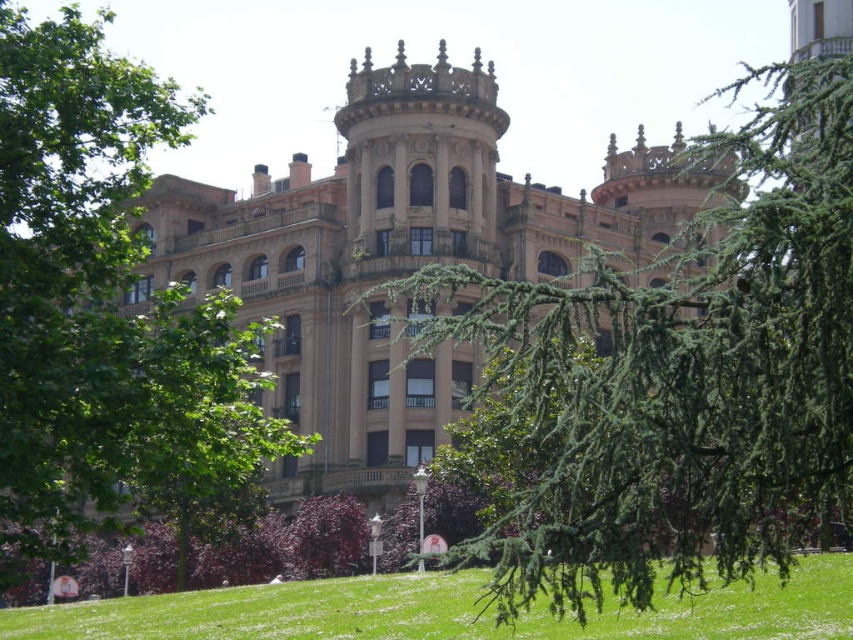
Looking at this image, who is positioned more to the left, green leafy tree at left or purple leafy tree at center?

Positioned to the left is green leafy tree at left.

Which is in front, point (183, 468) or point (317, 560)?

Positioned in front is point (183, 468).

Who is more distant from viewer, [86,92] or [303,541]?

The point [303,541] is behind.

You are a GUI agent. You are given a task and a screenshot of the screen. Output one action in this format:
    pyautogui.click(x=<x>, y=<y>)
    Task: Click on the green leafy tree at left
    This screenshot has width=853, height=640.
    Given the screenshot: What is the action you would take?
    pyautogui.click(x=107, y=310)

Looking at this image, how distant is green needle-like branches at center from purple leafy tree at center?

They are 31.41 meters apart.

Which is above, green needle-like branches at center or purple leafy tree at center?

Positioned higher is green needle-like branches at center.

Is point (683, 474) farther from camera compared to point (317, 531)?

That is False.

The width and height of the screenshot is (853, 640). In order to click on green needle-like branches at center in this screenshot , I will do `click(682, 374)`.

Is brown stone palace at center positioned in front of purple leafy tree at center?

That is True.

Which of these two, brown stone palace at center or purple leafy tree at center, stands taller?

With more height is brown stone palace at center.

Between point (570, 232) and point (329, 560), which one is positioned behind?

The point (570, 232) is behind.

This screenshot has width=853, height=640. I want to click on brown stone palace at center, so click(393, 257).